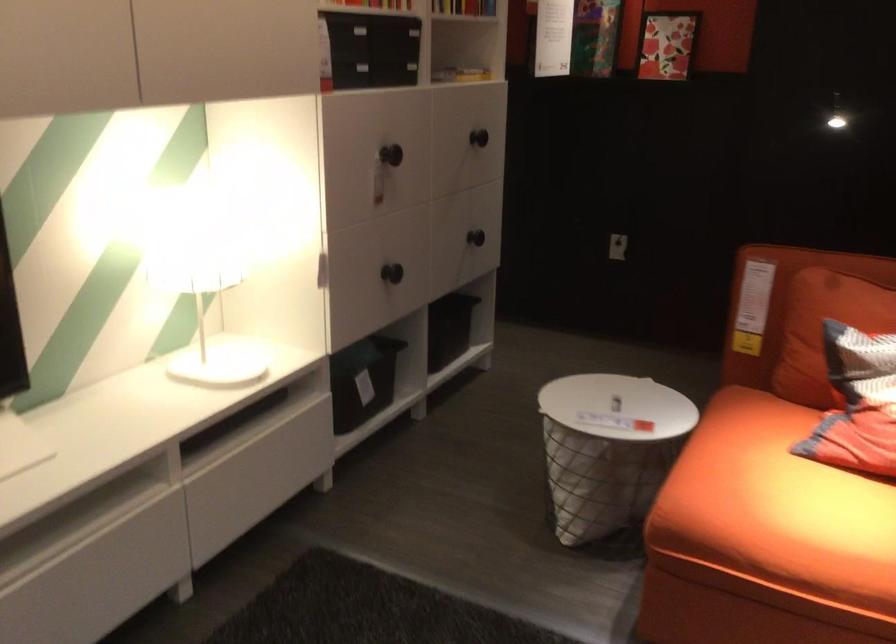
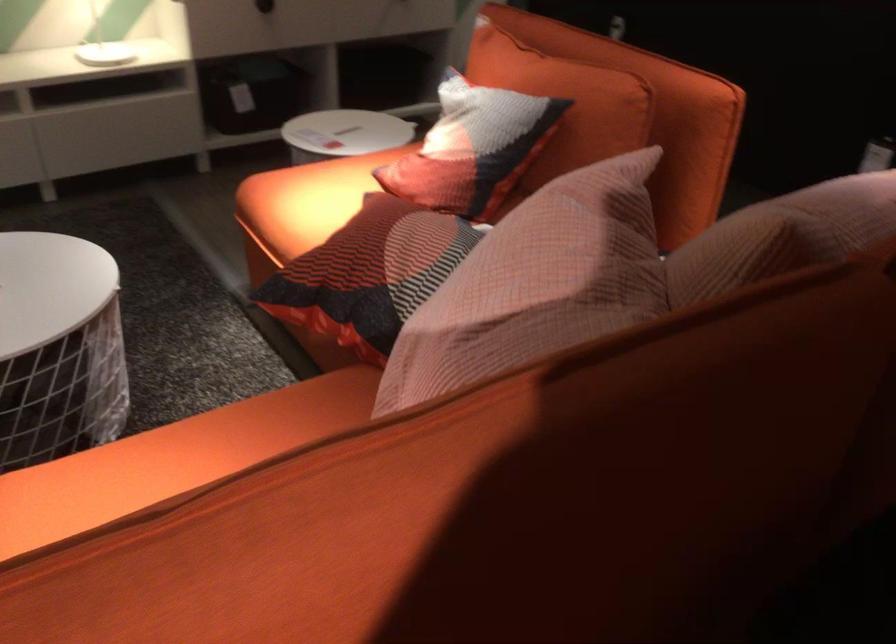
Find the pixel in the second image that matches (x=406, y=285) in the first image.

(264, 6)